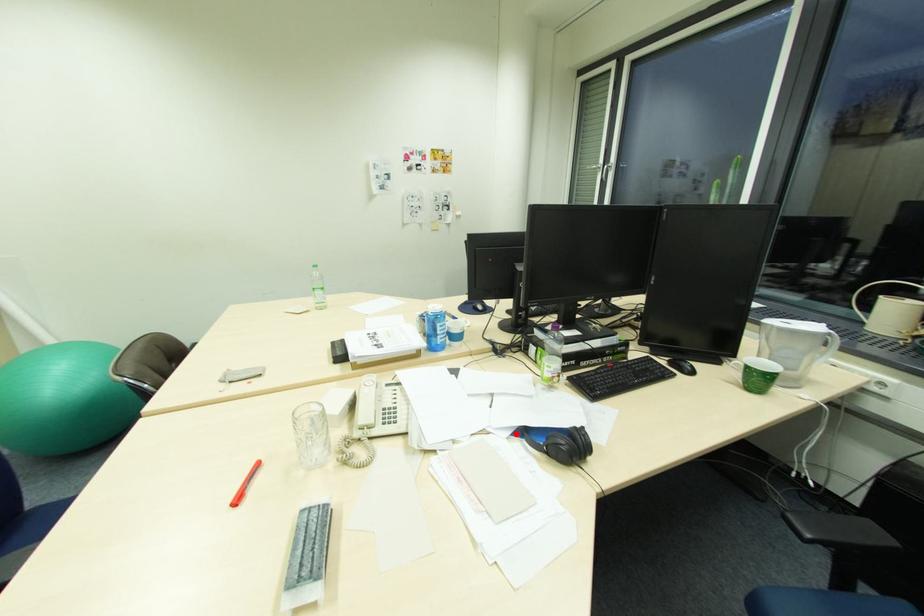
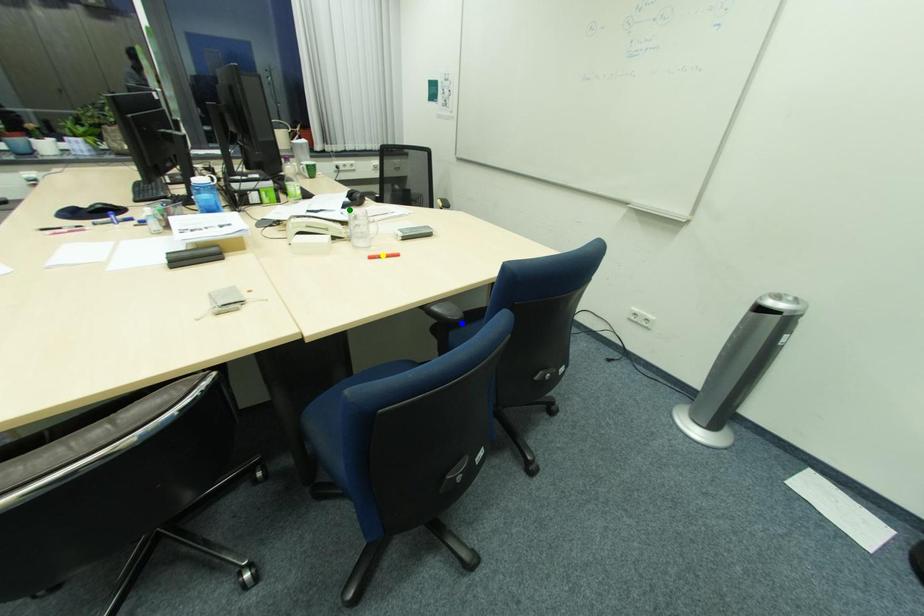
Question: I am providing you with two images of the same scene from different viewpoints. A red point is marked on the first image. You are given multiple points on the second image. In image 2, which mark is for the same physical point as the one in image 1?

Choices:
 (A) green point
 (B) blue point
 (C) yellow point

Answer: (A)